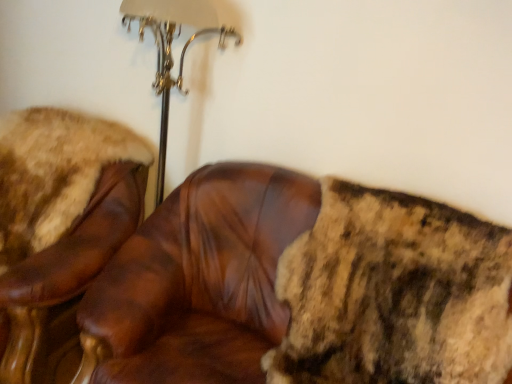
Question: Considering their positions, is brown leather chair at center, which ranks as the 2th chair in left-to-right order, located in front of or behind brown leather chair at upper left, the 2th chair in the right-to-left sequence?

Choices:
 (A) behind
 (B) front

Answer: (B)

Question: Is brown leather chair at center, acting as the first chair starting from the right, wider or thinner than brown leather chair at upper left, which is counted as the 1th chair, starting from the left?

Choices:
 (A) wide
 (B) thin

Answer: (B)

Question: From a real-world perspective, is brown leather chair at center, acting as the first chair starting from the right, physically located above or below brown leather chair at upper left, which is counted as the 1th chair, starting from the left?

Choices:
 (A) below
 (B) above

Answer: (B)

Question: Is brown leather chair at upper left, which is counted as the 1th chair, starting from the left, inside or outside of brown leather chair at center, which ranks as the 2th chair in left-to-right order?

Choices:
 (A) outside
 (B) inside

Answer: (A)

Question: Is point (4, 226) positioned closer to the camera than point (331, 263)?

Choices:
 (A) closer
 (B) farther

Answer: (B)

Question: From the image's perspective, is brown leather chair at upper left, the 2th chair in the right-to-left sequence, above or below brown leather chair at center, which ranks as the 2th chair in left-to-right order?

Choices:
 (A) below
 (B) above

Answer: (B)

Question: Considering their positions, is brown leather chair at upper left, which is counted as the 1th chair, starting from the left, located in front of or behind brown leather chair at center, which ranks as the 2th chair in left-to-right order?

Choices:
 (A) front
 (B) behind

Answer: (B)